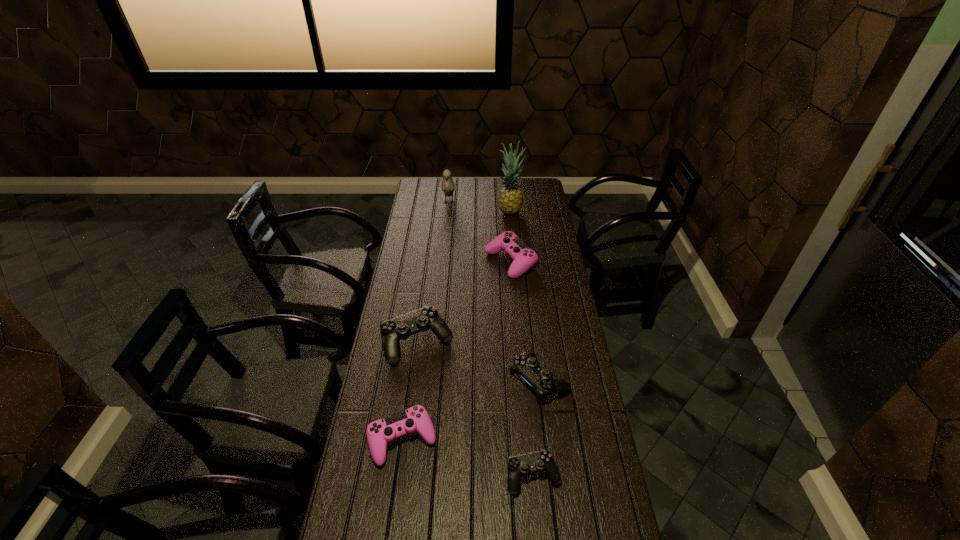
Where is `pineapple that is at the right edge`? pineapple that is at the right edge is located at coordinates (510, 199).

I want to click on vacant space at the far edge, so click(x=500, y=188).

Identify the location of free location at the left edge. (361, 428).

Locate an element on the screen. Image resolution: width=960 pixels, height=540 pixels. vacant space at the right edge of the desktop is located at coordinates (550, 431).

At what (x,y) coordinates should I click in order to perform the action: click on free space at the far left corner. Please return your answer as a coordinate pair (x, y). Looking at the image, I should click on (414, 197).

Where is `free point at the far right corner`? The image size is (960, 540). free point at the far right corner is located at coordinates (535, 185).

This screenshot has height=540, width=960. Find the location of `free spot between the sixth shortest object and the smallest black control`. free spot between the sixth shortest object and the smallest black control is located at coordinates (492, 339).

You are a GUI agent. You are given a task and a screenshot of the screen. Output one action in this format:
    pyautogui.click(x=<x>, y=<y>)
    Task: Click on the free area in between the yellow pineapple and the nearer pink control
    
    Given the screenshot: What is the action you would take?
    coord(456,326)

Where is `free space between the shortest object and the bird`? free space between the shortest object and the bird is located at coordinates (492, 339).

Locate an element on the screen. vacant point located between the white bird and the shortest object is located at coordinates (492, 339).